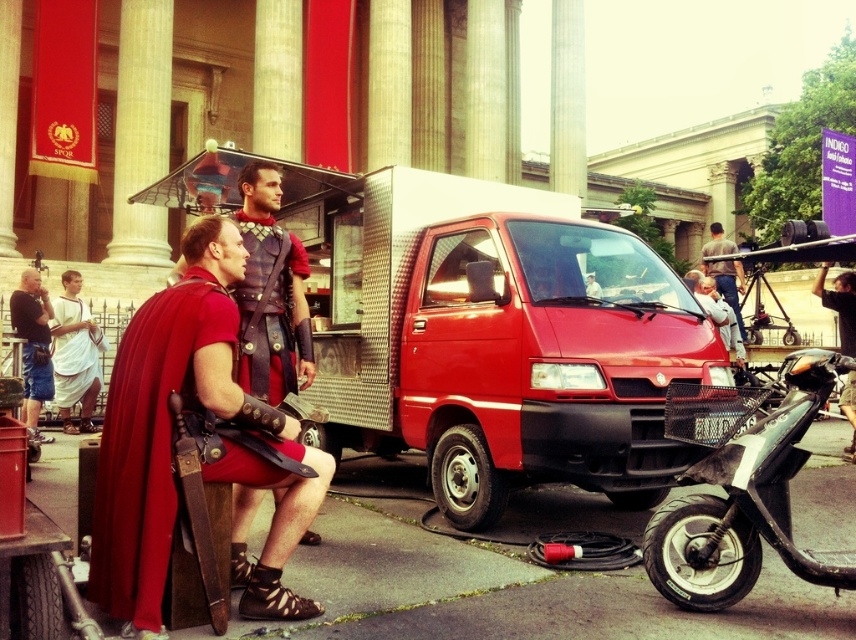
Looking at this image, you are a photographer at the event and need to position a camera at point 0.455, 0.318 to capture the matte black armor at center. Is this the correct location for the camera?

Yes, the camera positioned at point (271,291) will correctly capture the matte black armor at center as it is exactly at that coordinate.

Based on the photo, you are a photographer at the historical event. You need to adjust your equipment to focus on the person in the white cotton toga at left. Can you move the matte black camera at left upwards to get a better angle?

The matte black camera at left is located below the white cotton toga at left, so moving it upwards would position it closer to the subject, allowing for a better angle.